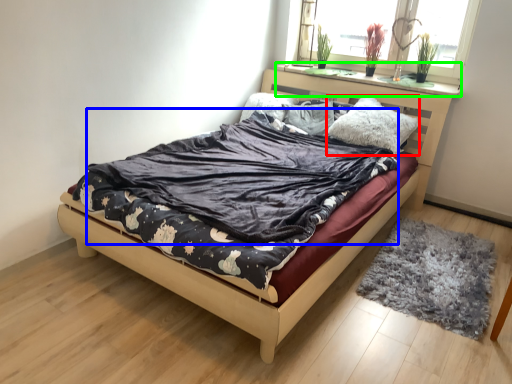
Question: Which is farther away from pillow (highlighted by a red box)? blanket (highlighted by a blue box) or window sill (highlighted by a green box)?

Choices:
 (A) blanket
 (B) window sill

Answer: (A)